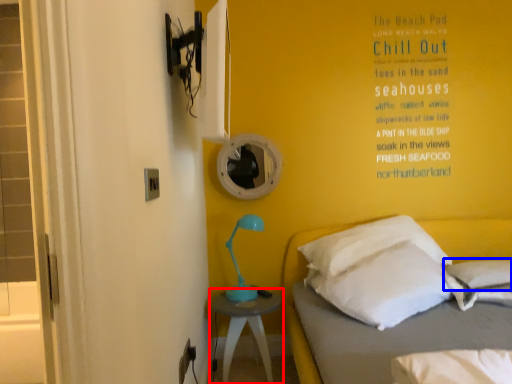
Question: Which of the following is the farthest to the observer, nightstand (highlighted by a red box) or pillow (highlighted by a blue box)?

Choices:
 (A) nightstand
 (B) pillow

Answer: (A)